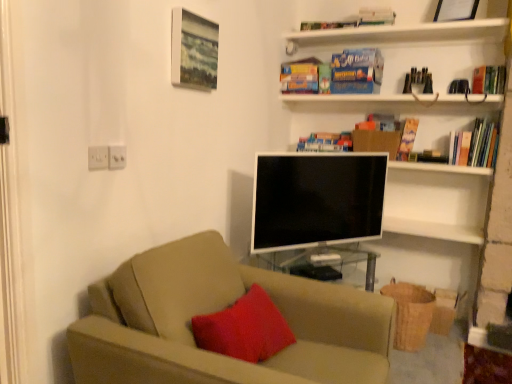
This screenshot has width=512, height=384. What do you see at coordinates (407, 138) in the screenshot?
I see `hardcover book at upper right, arranged as the first paperback book when viewed from the right` at bounding box center [407, 138].

Identify the location of hardcover book at upper right, acting as the third paperback book starting from the left. This screenshot has width=512, height=384. (407, 138).

What do you see at coordinates (326, 142) in the screenshot? This screenshot has width=512, height=384. I see `blue matte bookshelf at upper center, positioned as the 1th book in bottom-to-top order` at bounding box center [326, 142].

The height and width of the screenshot is (384, 512). What do you see at coordinates (317, 199) in the screenshot?
I see `white glossy flat-screen tv at center` at bounding box center [317, 199].

You are a GUI agent. You are given a task and a screenshot of the screen. Output one action in this format:
    pyautogui.click(x=<x>, y=<y>)
    Task: Click on the white cardboard box at upper center, the third book when ordered from left to right
    
    Given the screenshot: What is the action you would take?
    pyautogui.click(x=376, y=16)

At what (x,y) coordinates should I click in order to perform the action: click on wooden picture frame at upper right, which appears as the 1th picture frame when viewed from the top. Please return your answer as a coordinate pair (x, y). Image resolution: width=512 pixels, height=384 pixels. Looking at the image, I should click on (455, 10).

Measure the distance between wooden picture frame at upper right, which is counted as the second picture frame, starting from the left, and camera.

The distance of wooden picture frame at upper right, which is counted as the second picture frame, starting from the left, from camera is 2.50 meters.

Measure the distance between point (500, 84) and camera.

The depth of point (500, 84) is 8.00 feet.

The height and width of the screenshot is (384, 512). What do you see at coordinates (489, 80) in the screenshot?
I see `hardcover book at upper right, placed as the fourth book when sorted from left to right` at bounding box center [489, 80].

The height and width of the screenshot is (384, 512). Find the location of `wooden textured picture frame at upper center, the second picture frame positioned from the top`. wooden textured picture frame at upper center, the second picture frame positioned from the top is located at coordinates pyautogui.click(x=194, y=50).

Image resolution: width=512 pixels, height=384 pixels. What are the coordinates of `hardcover book at upper right, arranged as the first paperback book when viewed from the right` in the screenshot? It's located at (407, 138).

Is hardcover book at upper right, acting as the third paperback book starting from the left, behind wooden picture frame at upper right, which is the 1th picture frame in right-to-left order?

Yes, hardcover book at upper right, acting as the third paperback book starting from the left, is behind wooden picture frame at upper right, which is the 1th picture frame in right-to-left order.

Which of these two, hardcover book at upper right, arranged as the first paperback book when viewed from the right, or wooden picture frame at upper right, which ranks as the 1th picture frame in back-to-front order, is thinner?

Thinner between the two is hardcover book at upper right, arranged as the first paperback book when viewed from the right.

Where is `picture frame on the right of hardcover book at upper right, arranged as the first paperback book when viewed from the right`? Image resolution: width=512 pixels, height=384 pixels. picture frame on the right of hardcover book at upper right, arranged as the first paperback book when viewed from the right is located at coordinates (455, 10).

Considering the sizes of objects hardcover book at upper right, acting as the third paperback book starting from the left, and wooden picture frame at upper right, the 2th picture frame positioned from the bottom, in the image provided, who is taller, hardcover book at upper right, acting as the third paperback book starting from the left, or wooden picture frame at upper right, the 2th picture frame positioned from the bottom,?

hardcover book at upper right, acting as the third paperback book starting from the left, is taller.

Does velvety red pillow at center appear on the right side of hardcover book at upper right, placed as the fourth book when sorted from left to right?

In fact, velvety red pillow at center is to the left of hardcover book at upper right, placed as the fourth book when sorted from left to right.

Can you see velvety red pillow at center touching hardcover book at upper right, marked as the 3th book in a top-to-bottom arrangement?

No, velvety red pillow at center is not touching hardcover book at upper right, marked as the 3th book in a top-to-bottom arrangement.

Is point (211, 344) closer to camera compared to point (497, 73)?

That is True.

Locate an element on the screen. This screenshot has height=384, width=512. the 1st book behind the velvety red pillow at center is located at coordinates 489,80.

Which is behind, wooden textured picture frame at upper center, the 2th picture frame from the right, or white glossy flat-screen tv at center?

white glossy flat-screen tv at center is further from the camera.

Does point (185, 30) appear closer or farther from the camera than point (315, 216)?

Point (185, 30).

Can you confirm if wooden textured picture frame at upper center, the second picture frame positioned from the top, is wider than white glossy flat-screen tv at center?

No, wooden textured picture frame at upper center, the second picture frame positioned from the top, is not wider than white glossy flat-screen tv at center.

Considering the relative sizes of hardcover book at upper center, the first paperback book in the left-to-right sequence, and wooden picture frame at upper right, the 2th picture frame positioned from the bottom, in the image provided, is hardcover book at upper center, the first paperback book in the left-to-right sequence, bigger than wooden picture frame at upper right, the 2th picture frame positioned from the bottom,?

Yes.

Can you confirm if hardcover book at upper center, the first paperback book in the left-to-right sequence, is taller than wooden picture frame at upper right, which ranks as the 1th picture frame in back-to-front order?

Yes.

Based on their positions, is hardcover book at upper center, placed as the 3th paperback book when sorted from right to left, located to the left or right of wooden picture frame at upper right, the 2th picture frame positioned from the bottom?

hardcover book at upper center, placed as the 3th paperback book when sorted from right to left, is positioned on wooden picture frame at upper right, the 2th picture frame positioned from the bottom,'s left side.

Considering the positions of objects wooden textured picture frame at upper center, the 2th picture frame from the right, and blue cardboard paperback book at upper center, which is the 2th paperback book from left to right, in the image provided, who is more to the left, wooden textured picture frame at upper center, the 2th picture frame from the right, or blue cardboard paperback book at upper center, which is the 2th paperback book from left to right,?

Positioned to the left is wooden textured picture frame at upper center, the 2th picture frame from the right.

I want to click on paperback book that is the 1st one when counting backward from the wooden textured picture frame at upper center, which is the 1th picture frame in front-to-back order, so click(x=356, y=71).

Is wooden textured picture frame at upper center, marked as the 1th picture frame in a bottom-to-top arrangement, shorter than blue cardboard paperback book at upper center, the second paperback book when ordered from right to left?

Incorrect, the height of wooden textured picture frame at upper center, marked as the 1th picture frame in a bottom-to-top arrangement, does not fall short of that of blue cardboard paperback book at upper center, the second paperback book when ordered from right to left.

Considering the sizes of objects wooden textured picture frame at upper center, which is the 1th picture frame in front-to-back order, and blue cardboard paperback book at upper center, which is the 2th paperback book from left to right, in the image provided, who is thinner, wooden textured picture frame at upper center, which is the 1th picture frame in front-to-back order, or blue cardboard paperback book at upper center, which is the 2th paperback book from left to right,?

With smaller width is wooden textured picture frame at upper center, which is the 1th picture frame in front-to-back order.

Between white cardboard box at upper center, which appears as the 2th book when viewed from the right, and beige fabric couch at center, which one is positioned in front?

beige fabric couch at center is more forward.

Considering the sizes of objects white cardboard box at upper center, which appears as the 2th book when viewed from the right, and beige fabric couch at center in the image provided, who is shorter, white cardboard box at upper center, which appears as the 2th book when viewed from the right, or beige fabric couch at center?

white cardboard box at upper center, which appears as the 2th book when viewed from the right, is shorter.

Considering the positions of point (374, 23) and point (307, 365), is point (374, 23) closer or farther from the camera than point (307, 365)?

Point (374, 23) appears to be farther away from the viewer than point (307, 365).

Can you confirm if blue matte bookshelf at upper center, the fourth book positioned from the top, is thinner than wooden picture frame at upper right, which ranks as the 1th picture frame in back-to-front order?

Correct, the width of blue matte bookshelf at upper center, the fourth book positioned from the top, is less than that of wooden picture frame at upper right, which ranks as the 1th picture frame in back-to-front order.

Is blue matte bookshelf at upper center, the first book from the left, turned away from wooden picture frame at upper right, marked as the 2th picture frame in a front-to-back arrangement?

blue matte bookshelf at upper center, the first book from the left, does not have its back to wooden picture frame at upper right, marked as the 2th picture frame in a front-to-back arrangement.

Is blue matte bookshelf at upper center, the first book from the left, not within wooden picture frame at upper right, which appears as the 1th picture frame when viewed from the top?

blue matte bookshelf at upper center, the first book from the left, lies outside wooden picture frame at upper right, which appears as the 1th picture frame when viewed from the top,'s area.

Between blue matte bookshelf at upper center, the first book from the left, and wooden picture frame at upper right, which appears as the 1th picture frame when viewed from the top, which one has larger size?

With larger size is wooden picture frame at upper right, which appears as the 1th picture frame when viewed from the top.

At what (x,y) coordinates should I click in order to perform the action: click on the 2nd picture frame directly above the hardcover book at upper right, acting as the third paperback book starting from the left (from a real-world perspective). Please return your answer as a coordinate pair (x, y). The height and width of the screenshot is (384, 512). Looking at the image, I should click on (455, 10).

Starting from the velvety red pillow at center, which book is the 1st one behind? Please provide its 2D coordinates.

[(489, 80)]

From the image, which object appears to be farther from blue matte bookshelf at upper center, the fourth book positioned from the top, wooden textured picture frame at upper center, the 2th picture frame from the right, or hardcover book at upper center, the first paperback book in the left-to-right sequence?

wooden textured picture frame at upper center, the 2th picture frame from the right, lies further to blue matte bookshelf at upper center, the fourth book positioned from the top, than the other object.

Based on their spatial positions, is wooden textured picture frame at upper center, acting as the second picture frame starting from the back, or hardcover book at upper right, arranged as the first paperback book when viewed from the right, further from blue matte bookshelf at upper center, the fourth book positioned from the right?

wooden textured picture frame at upper center, acting as the second picture frame starting from the back, is further to blue matte bookshelf at upper center, the fourth book positioned from the right.

Estimate the real-world distances between objects in this image. Which object is closer to beige fabric couch at center, wooden picture frame at upper right, which ranks as the 1th picture frame in back-to-front order, or velvety red pillow at center?

velvety red pillow at center.

From the image, which object appears to be farther from white cardboard box at upper center, the first book positioned from the top, velvety red pillow at center or beige fabric couch at center?

Among the two, velvety red pillow at center is located further to white cardboard box at upper center, the first book positioned from the top.

From the image, which object appears to be farther from wooden textured picture frame at upper center, which is the 1th picture frame in front-to-back order, white cardboard box at upper center, the 4th book positioned from the bottom, or hardcover book at upper right, the 2th book from the bottom?

Among the two, hardcover book at upper right, the 2th book from the bottom, is located further to wooden textured picture frame at upper center, which is the 1th picture frame in front-to-back order.

Looking at the image, which one is located further to hardcover book at upper center, placed as the 3th paperback book when sorted from right to left, wooden picture frame at upper right, the 2th picture frame positioned from the bottom, or velvety red pillow at center?

velvety red pillow at center.

Based on their spatial positions, is hardcover book at upper center, the first paperback book in the left-to-right sequence, or wooden textured picture frame at upper center, which is the 1th picture frame in front-to-back order, closer to blue matte bookshelf at upper center, the first book from the left?

hardcover book at upper center, the first paperback book in the left-to-right sequence, lies closer to blue matte bookshelf at upper center, the first book from the left, than the other object.

From the picture: Considering their positions, is blue cardboard paperback book at upper center, the second paperback book when ordered from right to left, positioned closer to hardcover book at upper right, acting as the third paperback book starting from the left, than white cardboard box at upper center, the 4th book positioned from the bottom?

blue cardboard paperback book at upper center, the second paperback book when ordered from right to left, is closer to hardcover book at upper right, acting as the third paperback book starting from the left.

Where is `paperback book positioned between velvety red pillow at center and hardcover book at upper right, acting as the third paperback book starting from the left, from near to far`? paperback book positioned between velvety red pillow at center and hardcover book at upper right, acting as the third paperback book starting from the left, from near to far is located at coordinates (356, 71).

Where is `television between wooden picture frame at upper right, marked as the 2th picture frame in a front-to-back arrangement, and beige fabric couch at center in the up-down direction`? This screenshot has height=384, width=512. television between wooden picture frame at upper right, marked as the 2th picture frame in a front-to-back arrangement, and beige fabric couch at center in the up-down direction is located at coordinates (317, 199).

Identify the location of television between beige fabric couch at center and blue cardboard paperback book at upper center, which is the 2th paperback book from left to right, from front to back. (317, 199).

Identify the location of television between white cardboard box at upper center, the third book when ordered from left to right, and velvety red pillow at center in the up-down direction. (317, 199).